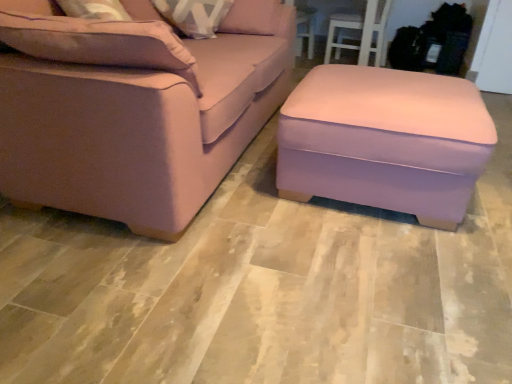
Question: Is purple fabric ottoman at center not near matte pink fabric couch at center?

Choices:
 (A) no
 (B) yes

Answer: (A)

Question: Can you confirm if purple fabric ottoman at center is shorter than matte pink fabric couch at center?

Choices:
 (A) yes
 (B) no

Answer: (A)

Question: Is purple fabric ottoman at center completely or partially outside of matte pink fabric couch at center?

Choices:
 (A) yes
 (B) no

Answer: (A)

Question: Is purple fabric ottoman at center closer to the viewer compared to matte pink fabric couch at center?

Choices:
 (A) yes
 (B) no

Answer: (B)

Question: Is matte pink fabric couch at center located within purple fabric ottoman at center?

Choices:
 (A) yes
 (B) no

Answer: (B)

Question: Is purple fabric ottoman at center placed right next to matte pink fabric couch at center?

Choices:
 (A) no
 (B) yes

Answer: (A)

Question: Is matte pink fabric couch at center beside purple fabric ottoman at center?

Choices:
 (A) yes
 (B) no

Answer: (B)

Question: Does matte pink fabric couch at center have a smaller size compared to purple fabric ottoman at center?

Choices:
 (A) yes
 (B) no

Answer: (B)

Question: Is matte pink fabric couch at center aimed at purple fabric ottoman at center?

Choices:
 (A) no
 (B) yes

Answer: (B)

Question: Is the depth of matte pink fabric couch at center less than that of purple fabric ottoman at center?

Choices:
 (A) no
 (B) yes

Answer: (B)

Question: Is matte pink fabric couch at center completely or partially outside of purple fabric ottoman at center?

Choices:
 (A) no
 (B) yes

Answer: (B)

Question: Would you say matte pink fabric couch at center is a long distance from purple fabric ottoman at center?

Choices:
 (A) no
 (B) yes

Answer: (A)

Question: From the image's perspective, is purple fabric ottoman at center located above or below matte pink fabric couch at center?

Choices:
 (A) above
 (B) below

Answer: (B)